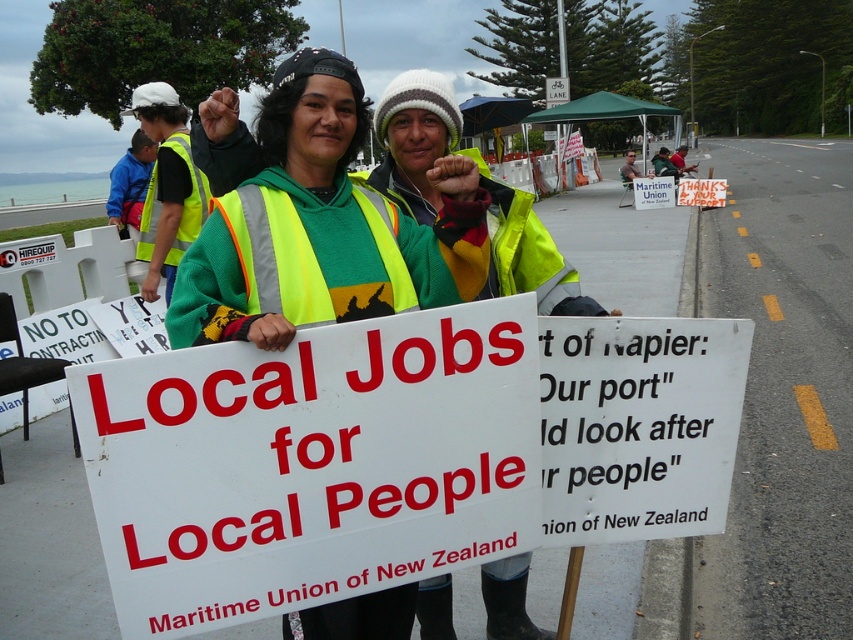
Does white paper sign at center have a lesser width compared to high visibility yellow vest at left?

No, white paper sign at center is not thinner than high visibility yellow vest at left.

This screenshot has width=853, height=640. Describe the element at coordinates (398, 452) in the screenshot. I see `white paper sign at center` at that location.

Locate an element on the screen. white paper sign at center is located at coordinates (398, 452).

Describe the element at coordinates (398, 452) in the screenshot. This screenshot has width=853, height=640. I see `white paper sign at center` at that location.

Is point (693, 324) positioned after point (367, 182)?

No.

Where is `white paper sign at center`? This screenshot has height=640, width=853. white paper sign at center is located at coordinates (398, 452).

Which of these two, reflective yellow safety vest at center or neon yellow reflective safety vest at center, stands taller?

reflective yellow safety vest at center is taller.

Find the location of a particular element. The image size is (853, 640). reflective yellow safety vest at center is located at coordinates (322, 227).